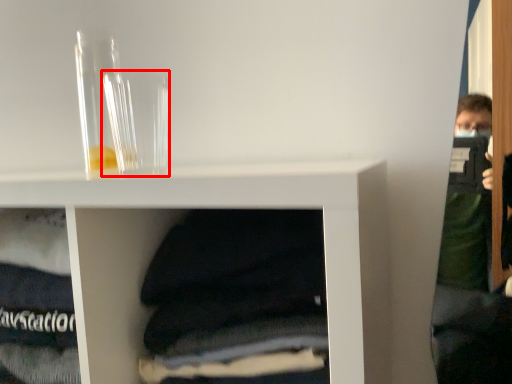
Question: Observing the image, what is the correct spatial positioning of glass vase (annotated by the red box) in reference to glass vase?

Choices:
 (A) right
 (B) left

Answer: (A)